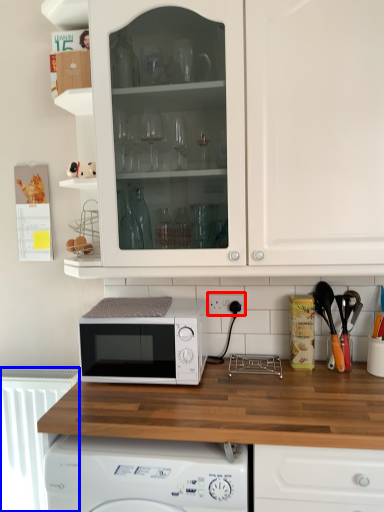
Question: Which point is further to the camera, electric outlet (highlighted by a red box) or radiator (highlighted by a blue box)?

Choices:
 (A) electric outlet
 (B) radiator

Answer: (B)